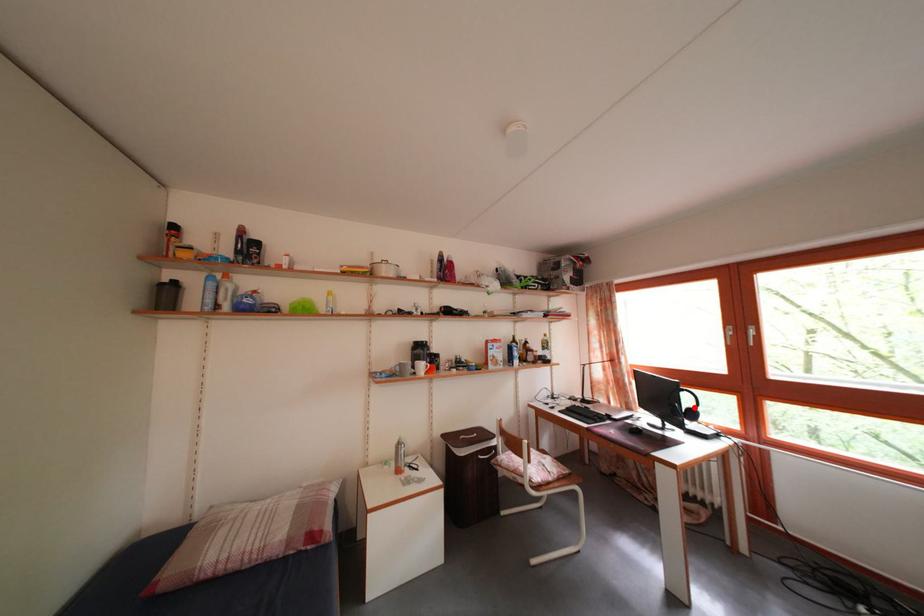
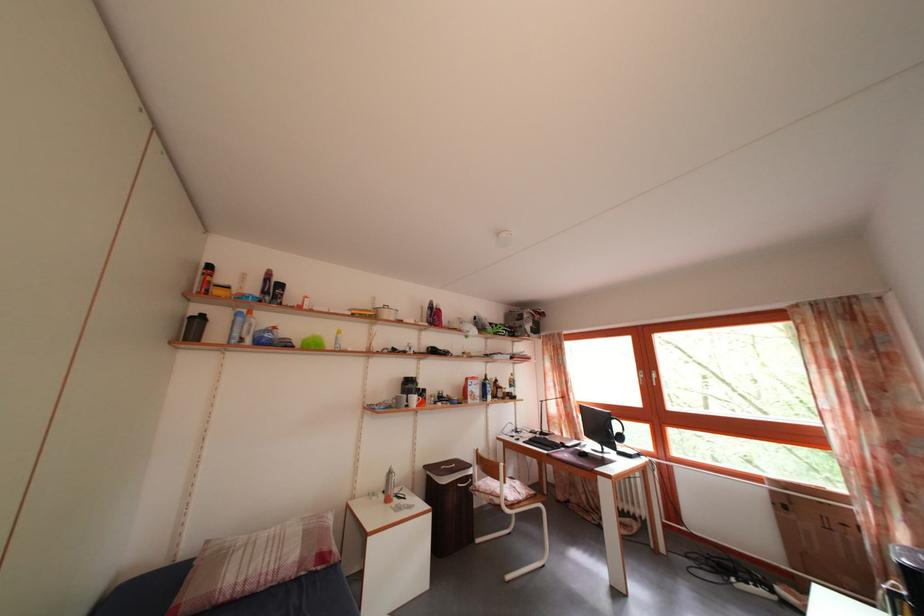
Locate, in the second image, the point that corresponds to the highlighted location in the first image.

(624, 434)